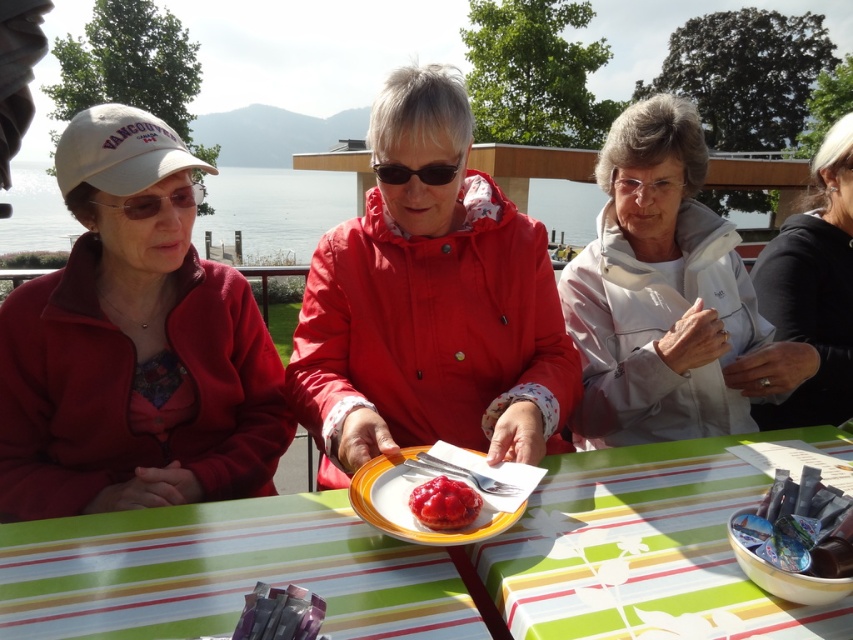
Question: Can you confirm if striped plastic table at center is positioned below glossy red jam tart at center?

Choices:
 (A) no
 (B) yes

Answer: (B)

Question: Which object appears closest to the camera in this image?

Choices:
 (A) glossy red jam tart at center
 (B) white matte jacket at upper right
 (C) striped plastic table at center

Answer: (C)

Question: Which object appears farthest from the camera in this image?

Choices:
 (A) white matte jacket at upper right
 (B) white matte jacket at center
 (C) yellow matte plate at center

Answer: (A)

Question: Is white matte jacket at center to the left of clear plastic goggles at left from the viewer's perspective?

Choices:
 (A) yes
 (B) no

Answer: (B)

Question: Which point appears farthest from the camera in this image?

Choices:
 (A) (180, 436)
 (B) (758, 595)
 (C) (438, 182)

Answer: (A)

Question: Can you confirm if clear blue water at upper center is thinner than glossy red jam tart at center?

Choices:
 (A) yes
 (B) no

Answer: (B)